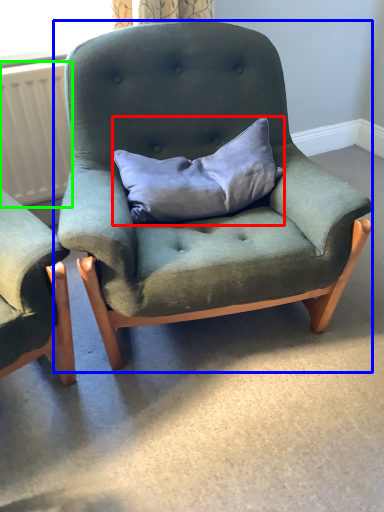
Question: Which object is the closest to the pillow (highlighted by a red box)? Choose among these: chair (highlighted by a blue box) or radiator (highlighted by a green box).

Choices:
 (A) chair
 (B) radiator

Answer: (A)